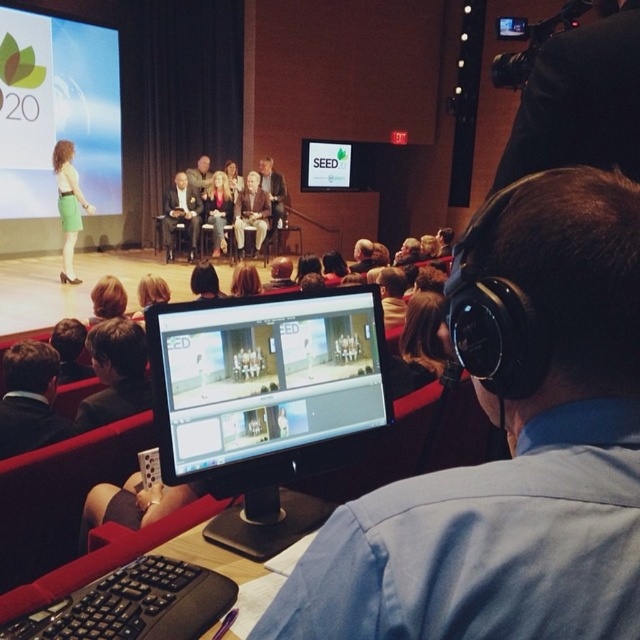
Does matte green skirt at left have a larger size compared to matte black suit at center?

Yes, matte green skirt at left is bigger than matte black suit at center.

Looking at this image, can you confirm if matte green skirt at left is positioned to the left of matte black suit at center?

Yes, matte green skirt at left is to the left of matte black suit at center.

Who is more distant from viewer, (67, 192) or (164, 205)?

Point (164, 205)

The height and width of the screenshot is (640, 640). I want to click on matte green skirt at left, so click(68, 205).

From the picture: Is dark brown leather jacket at lower left below matte black suit at center?

Indeed, dark brown leather jacket at lower left is positioned under matte black suit at center.

Consider the image. Does dark brown leather jacket at lower left have a greater height compared to matte black suit at center?

No.

Image resolution: width=640 pixels, height=640 pixels. I want to click on dark brown leather jacket at lower left, so click(x=29, y=400).

Locate an element on the screen. dark brown leather jacket at lower left is located at coordinates (29, 400).

Which is behind, point (365, 365) or point (189, 189)?

The point (189, 189) is more distant.

Measure the distance between point (193, 365) and camera.

1.19 meters

Image resolution: width=640 pixels, height=640 pixels. Find the location of `matte black monitor at center`. matte black monitor at center is located at coordinates (264, 381).